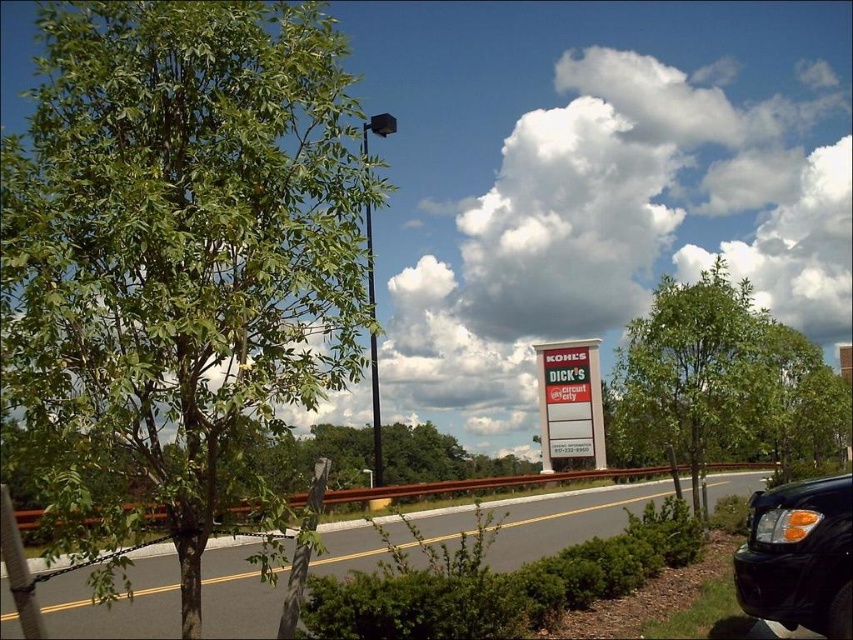
You are a delivery driver who needs to park your black matte truck at lower right behind the red plastic sign at center. Can the truck fit vertically behind the sign without hitting it?

The black matte truck at lower right is taller than the red plastic sign at center, so the truck cannot fit vertically behind the sign without hitting it.

What is the exact coordinate position of the black matte truck at lower right?

The black matte truck at lower right is located at coordinate point (798, 556).

You are a delivery person with a cart that is 2 meters wide. You need to move from the green leafy tree at left to the asphalt road at center. Is there enough space between them for your cart to pass through?

The distance between the green leafy tree at left and the asphalt road at center is 7.88 meters, which is more than enough for a 2 meter wide cart to pass through safely.